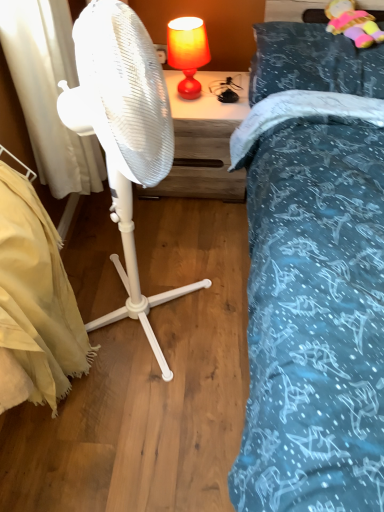
What are the coordinates of `vacant area that lies between white plastic fan at center and wooden nightstand at center` in the screenshot? It's located at (187, 234).